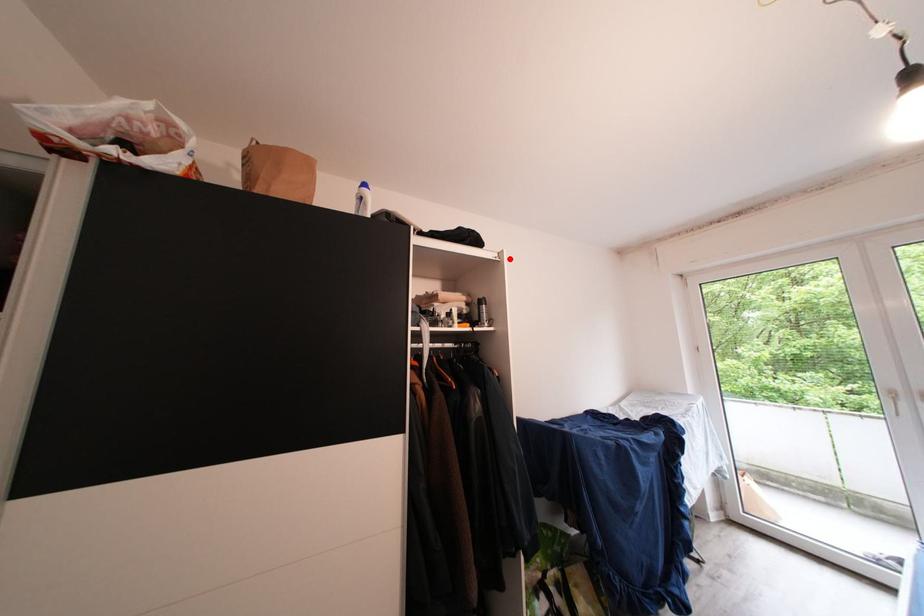
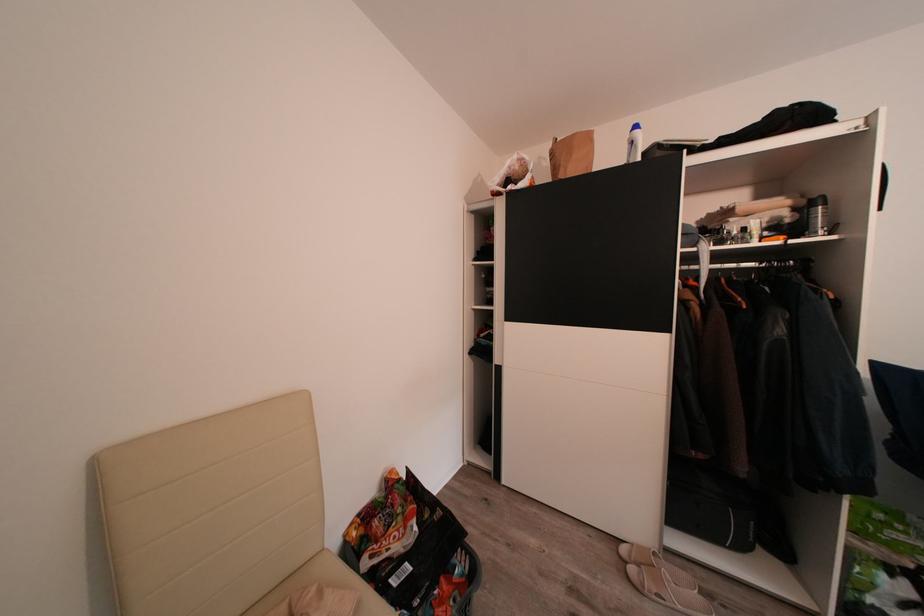
Question: I am providing you with two images of the same scene from different viewpoints. A red point is marked on the first image. Can you still see the location of the red point in image 2?

Choices:
 (A) Yes
 (B) No

Answer: (A)